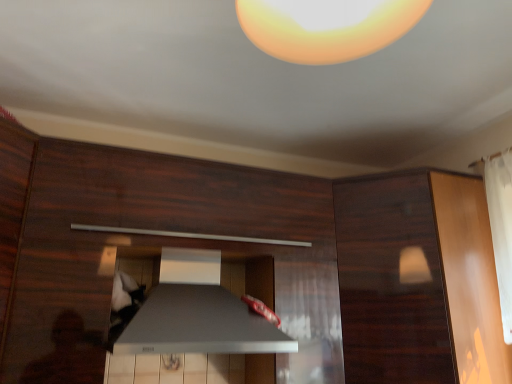
Question: Is dark wood cabinet at upper right positioned behind satin silver exhaust hood at center?

Choices:
 (A) yes
 (B) no

Answer: (A)

Question: Is dark wood cabinet at upper right at the left side of satin silver exhaust hood at center?

Choices:
 (A) no
 (B) yes

Answer: (A)

Question: Can you confirm if dark wood cabinet at upper right is bigger than satin silver exhaust hood at center?

Choices:
 (A) no
 (B) yes

Answer: (B)

Question: Is dark wood cabinet at upper right far from satin silver exhaust hood at center?

Choices:
 (A) no
 (B) yes

Answer: (A)

Question: Does dark wood cabinet at upper right have a greater width compared to satin silver exhaust hood at center?

Choices:
 (A) no
 (B) yes

Answer: (B)

Question: Considering the positions of point (396, 263) and point (137, 233), is point (396, 263) closer or farther from the camera than point (137, 233)?

Choices:
 (A) farther
 (B) closer

Answer: (A)

Question: Choose the correct answer: Is dark wood cabinet at upper right inside satin silver drawer at center or outside it?

Choices:
 (A) inside
 (B) outside

Answer: (A)

Question: Considering the positions of dark wood cabinet at upper right and satin silver drawer at center in the image, is dark wood cabinet at upper right bigger or smaller than satin silver drawer at center?

Choices:
 (A) small
 (B) big

Answer: (A)

Question: Based on their positions, is dark wood cabinet at upper right located to the left or right of satin silver drawer at center?

Choices:
 (A) right
 (B) left

Answer: (A)

Question: From a real-world perspective, is satin silver exhaust hood at center physically located above or below dark wood cabinet at upper right?

Choices:
 (A) above
 (B) below

Answer: (B)

Question: From their relative heights in the image, would you say satin silver exhaust hood at center is taller or shorter than dark wood cabinet at upper right?

Choices:
 (A) short
 (B) tall

Answer: (A)

Question: From the image's perspective, is satin silver exhaust hood at center located above or below dark wood cabinet at upper right?

Choices:
 (A) below
 (B) above

Answer: (A)

Question: Considering the relative positions of satin silver exhaust hood at center and dark wood cabinet at upper right in the image provided, is satin silver exhaust hood at center to the left or to the right of dark wood cabinet at upper right?

Choices:
 (A) right
 (B) left

Answer: (B)

Question: In terms of size, does dark wood cabinet at upper right appear bigger or smaller than satin silver exhaust hood at center?

Choices:
 (A) small
 (B) big

Answer: (B)

Question: Is point (495, 375) positioned closer to the camera than point (202, 306)?

Choices:
 (A) farther
 (B) closer

Answer: (A)